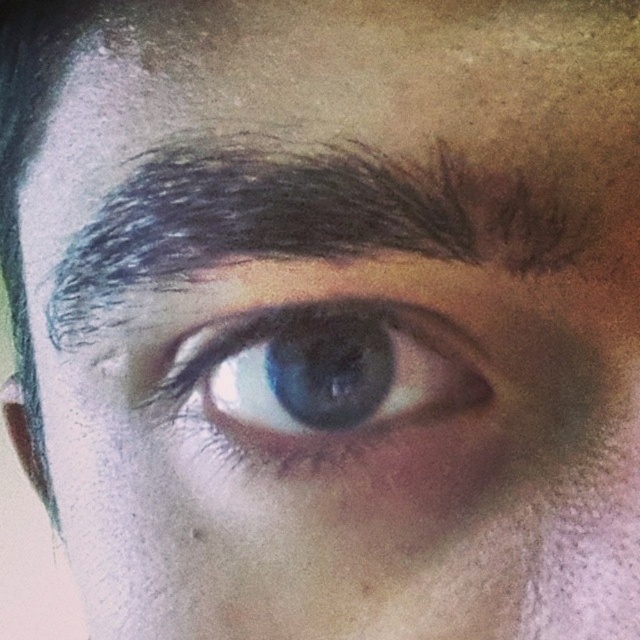
Is dark brown hair at upper center taller than blue glossy eye at center?

Yes.

Is point (449, 252) positioned after point (284, 417)?

No, it is in front of (284, 417).

Is point (184, 189) in front of point (337, 310)?

Yes.

Locate an element on the screen. This screenshot has width=640, height=640. dark brown hair at upper center is located at coordinates (296, 221).